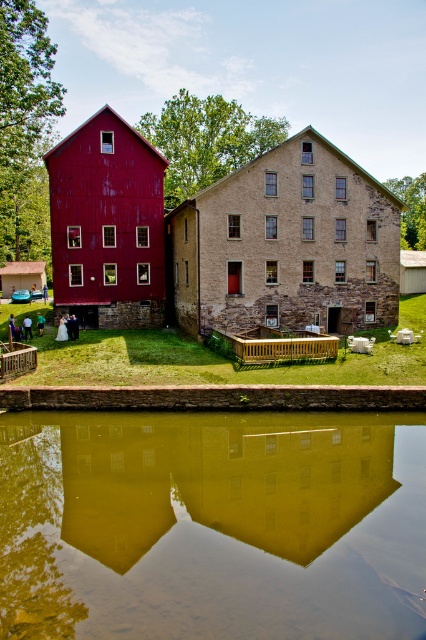
Looking at this image, does green reflective water at center have a larger size compared to matte red barn at left?

Actually, green reflective water at center might be smaller than matte red barn at left.

Is the position of green reflective water at center less distant than that of matte red barn at left?

That is True.

What do you see at coordinates (212, 525) in the screenshot? The width and height of the screenshot is (426, 640). I see `green reflective water at center` at bounding box center [212, 525].

At what (x,y) coordinates should I click in order to perform the action: click on green reflective water at center. Please return your answer as a coordinate pair (x, y). The height and width of the screenshot is (640, 426). Looking at the image, I should click on (212, 525).

Can you confirm if brown stone barn at center is bigger than matte red barn at left?

Yes, brown stone barn at center is bigger than matte red barn at left.

Is brown stone barn at center thinner than matte red barn at left?

Incorrect, brown stone barn at center's width is not less than matte red barn at left's.

In order to click on brown stone barn at center in this screenshot , I will do `click(287, 244)`.

Does point (412, 492) come closer to viewer compared to point (222, 260)?

Yes.

Between green reflective water at center and brown stone barn at center, which one has more height?

Standing taller between the two is brown stone barn at center.

Is point (40, 552) closer to camera compared to point (298, 307)?

That is True.

This screenshot has width=426, height=640. I want to click on green reflective water at center, so [212, 525].